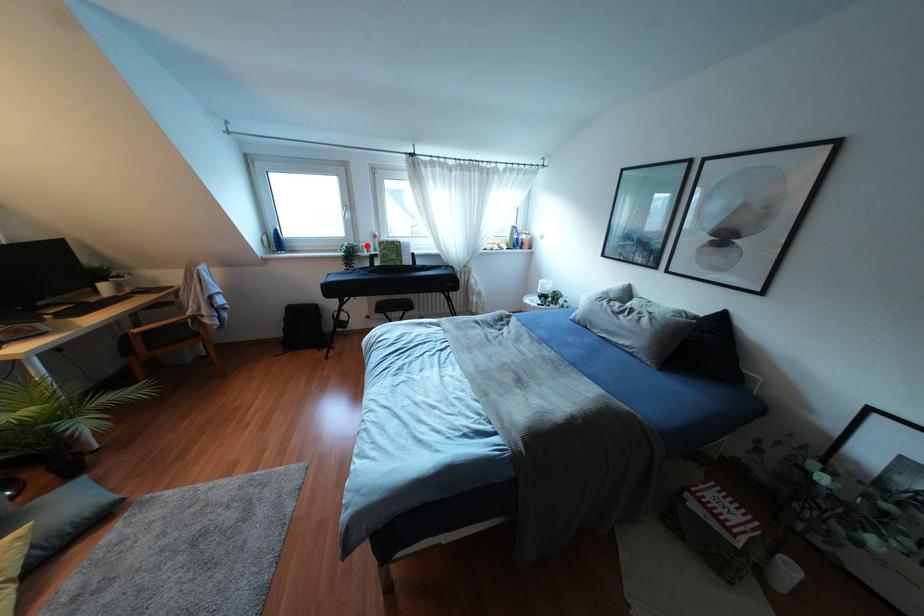
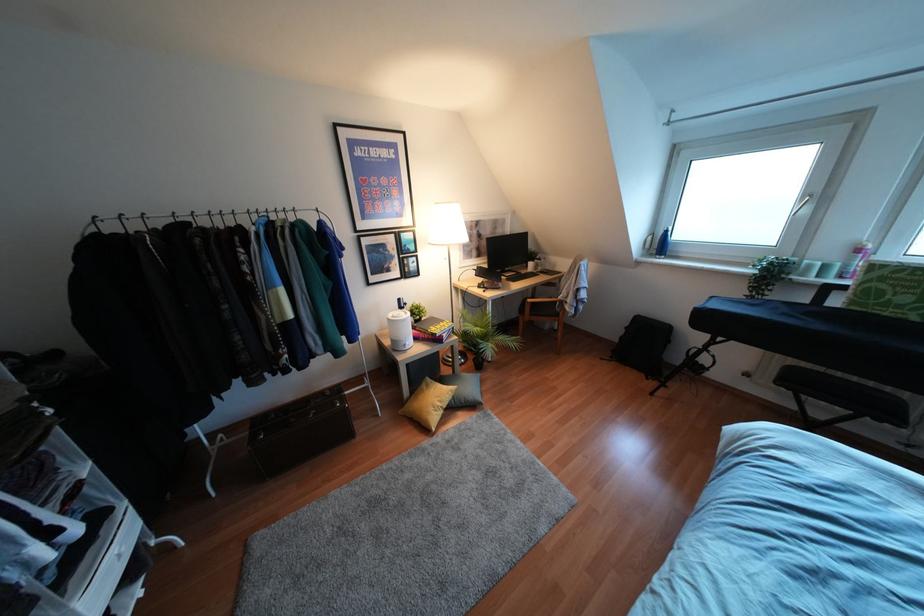
In the second image, find the point that corresponds to the highlighted location in the first image.

(824, 267)